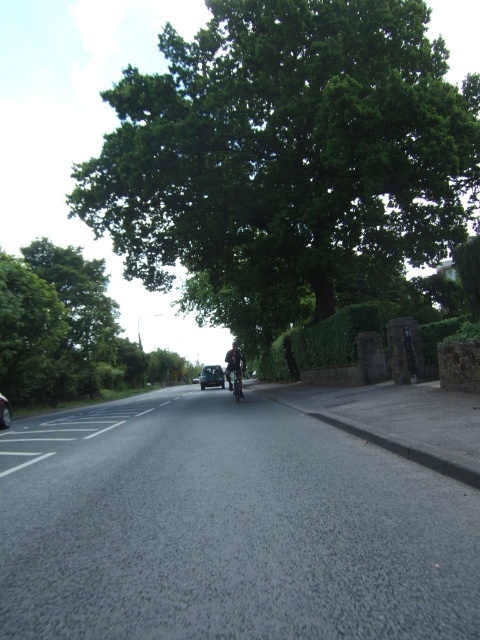
Question: Which object appears closest to the camera in this image?

Choices:
 (A) metallic silver motorcycle at center
 (B) green leafy tree at center

Answer: (B)

Question: Does green leafy tree at center appear under metallic silver car at center?

Choices:
 (A) no
 (B) yes

Answer: (A)

Question: Is green leafy tree at center below green leafy tree at upper center?

Choices:
 (A) no
 (B) yes

Answer: (A)

Question: Observing the image, what is the correct spatial positioning of green leafy tree at center in reference to metallic silver motorcycle at center?

Choices:
 (A) right
 (B) left

Answer: (B)

Question: Which of the following is the closest to the observer?

Choices:
 (A) metallic silver car at center
 (B) green leafy tree at upper center
 (C) green leafy tree at center

Answer: (C)

Question: Among these points, which one is nearest to the camera?

Choices:
 (A) (147, 141)
 (B) (235, 378)
 (C) (50, 358)
 (D) (202, 376)

Answer: (B)